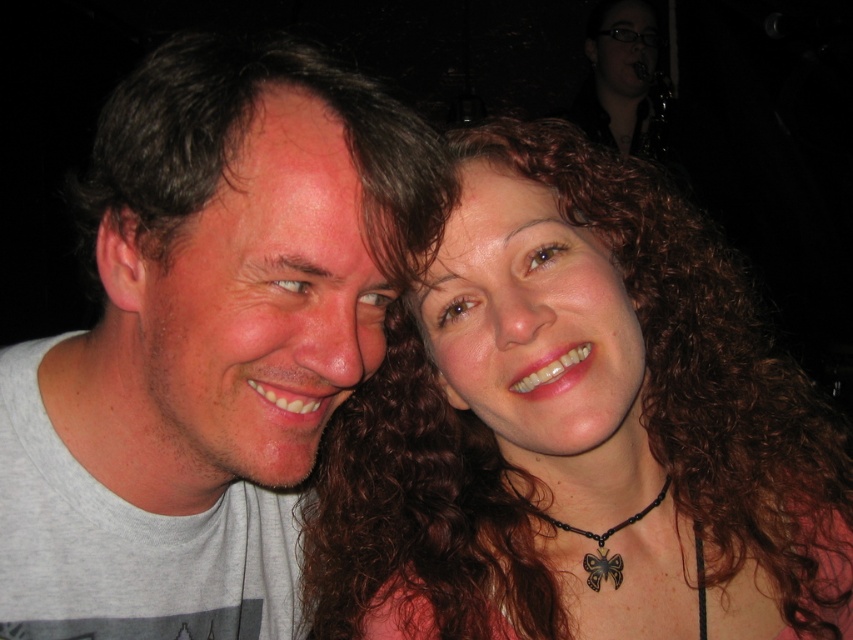
In the scene shown: Can you confirm if gray t-shirt at left is shorter than black beaded necklace with butterfly pendant at center?

No, gray t-shirt at left is not shorter than black beaded necklace with butterfly pendant at center.

Which is behind, point (300, 68) or point (592, 579)?

The point (592, 579) is more distant.

Between point (360, 314) and point (572, 529), which one is positioned in front?

Point (360, 314)

The image size is (853, 640). What are the coordinates of `gray t-shirt at left` in the screenshot? It's located at (206, 342).

Is point (218, 609) farther from camera compared to point (138, 70)?

Yes.

Looking at this image, which is more to the left, gray t-shirt at left or dark brown curly hair at left?

Positioned to the left is gray t-shirt at left.

Locate an element on the screen. Image resolution: width=853 pixels, height=640 pixels. gray t-shirt at left is located at coordinates (206, 342).

Where is `matte pink hair at center`? matte pink hair at center is located at coordinates (578, 428).

Which is above, matte pink hair at center or gray t-shirt at left?

Positioned higher is gray t-shirt at left.

This screenshot has width=853, height=640. Describe the element at coordinates (578, 428) in the screenshot. I see `matte pink hair at center` at that location.

Where is `matte pink hair at center`? The width and height of the screenshot is (853, 640). matte pink hair at center is located at coordinates (578, 428).